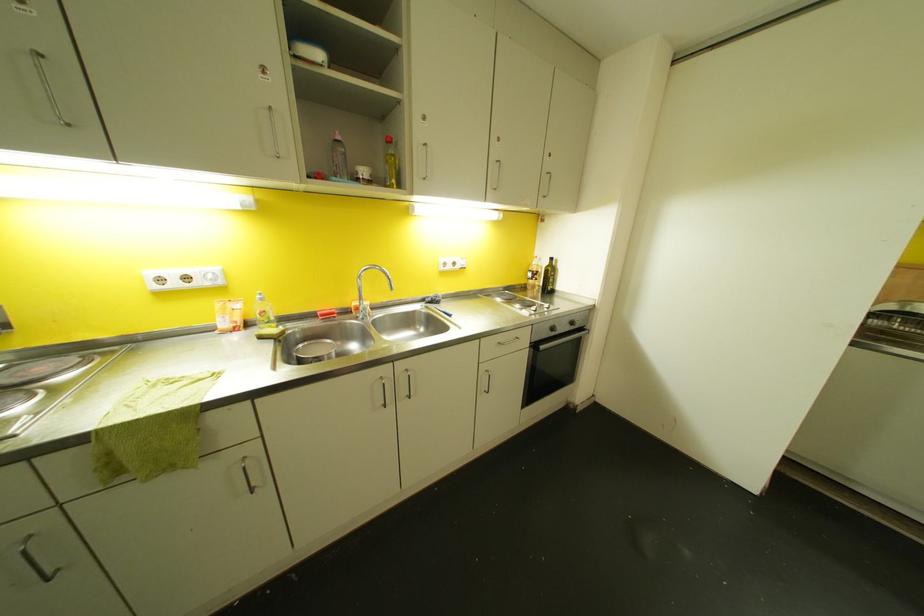
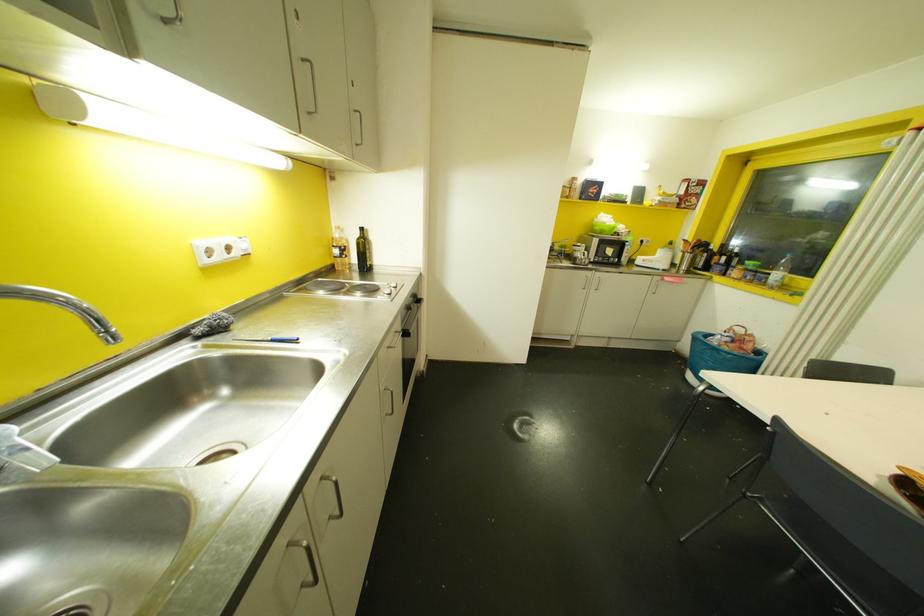
Where in the second image is the point corresponding to the point at 552,329 from the first image?

(407, 307)